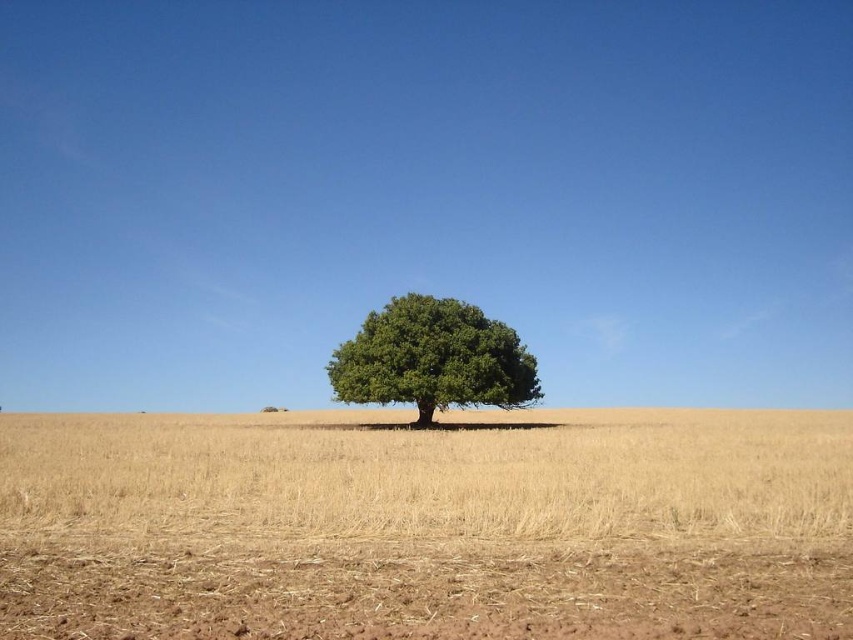
You are an environmental scientist observing the landscape. You notice the yellow dry grass at center and the green leafy tree at center. Based on their positions, which one is closer to your viewpoint?

The yellow dry grass at center is in front of the green leafy tree at center, so it is closer to your viewpoint.

You are standing at the center of the image and want to place a small red flag exactly at the location of the yellow dry grass at center. What are the coordinates where you should place the flag?

The coordinates for the yellow dry grass at center are at point [427,525], so you should place the flag at those coordinates.